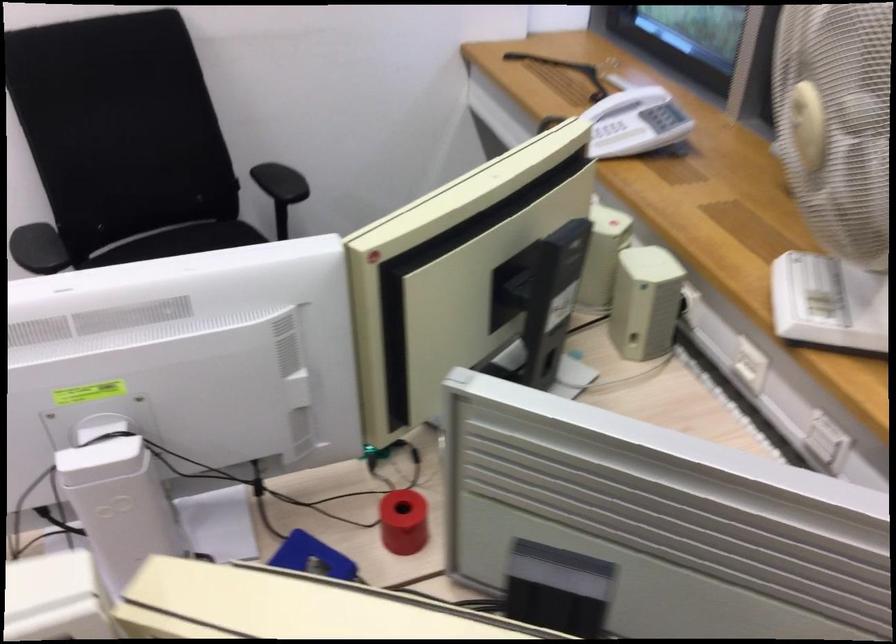
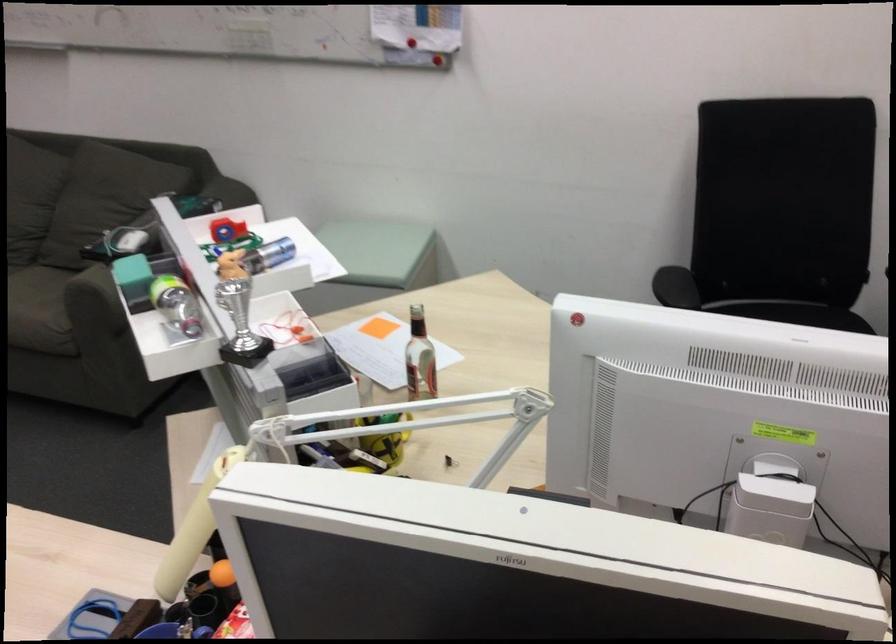
The point at (119,478) is marked in the first image. Where is the corresponding point in the second image?

(770, 509)